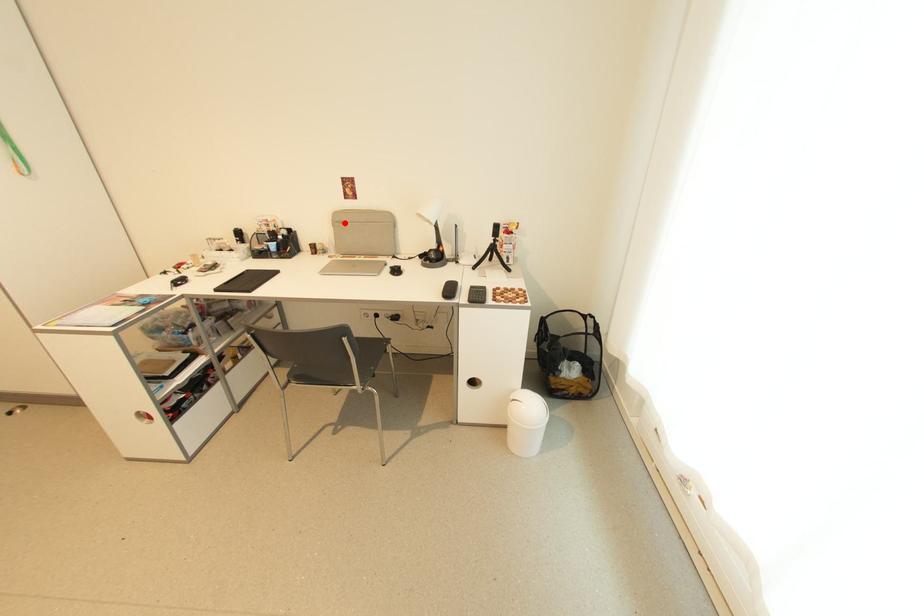
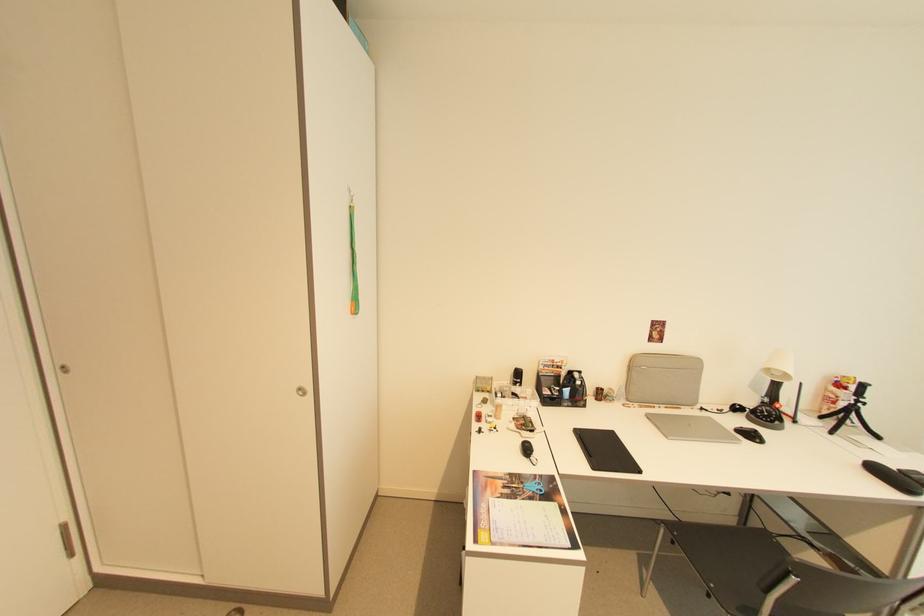
Question: I am providing you with two images of the same scene from different viewpoints. Given a red point in image1, look at the same physical point in image2. Is it:

Choices:
 (A) Closer to the viewpoint
 (B) Farther from the viewpoint

Answer: (B)